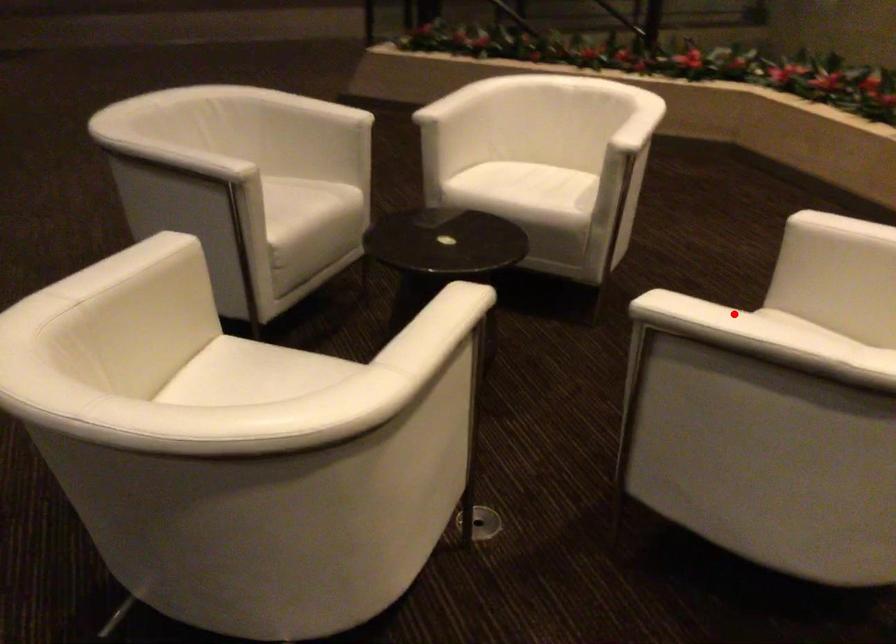
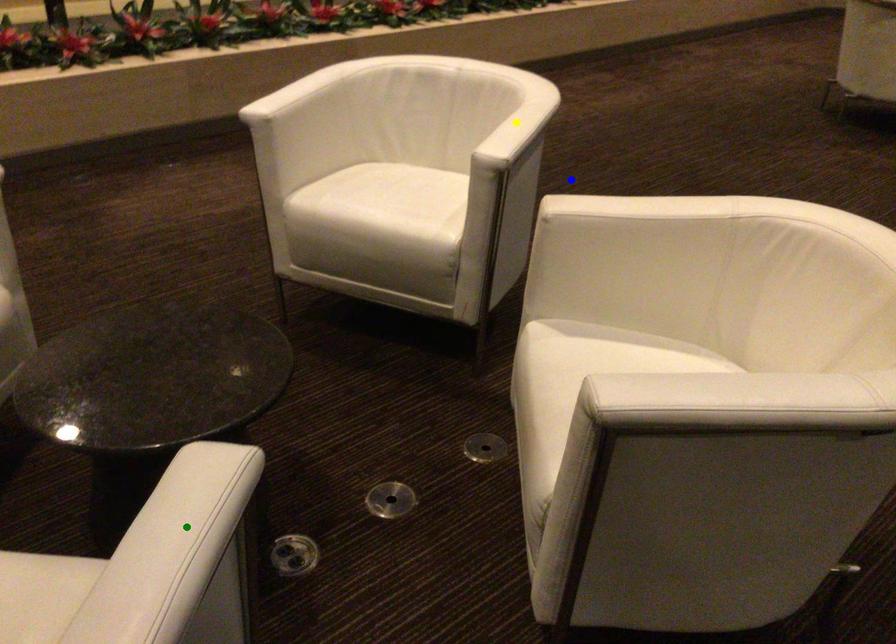
Question: I am providing you with two images of the same scene from different viewpoints. A red point is marked on the first image. You are given multiple points on the second image. Which mark in image 2 goes with the point in image 1?

Choices:
 (A) green point
 (B) blue point
 (C) yellow point

Answer: (C)